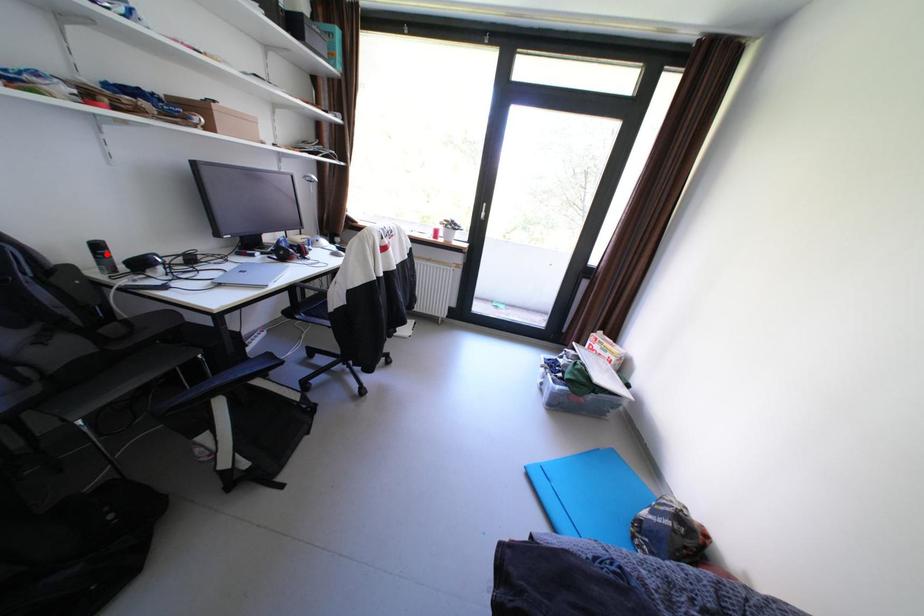
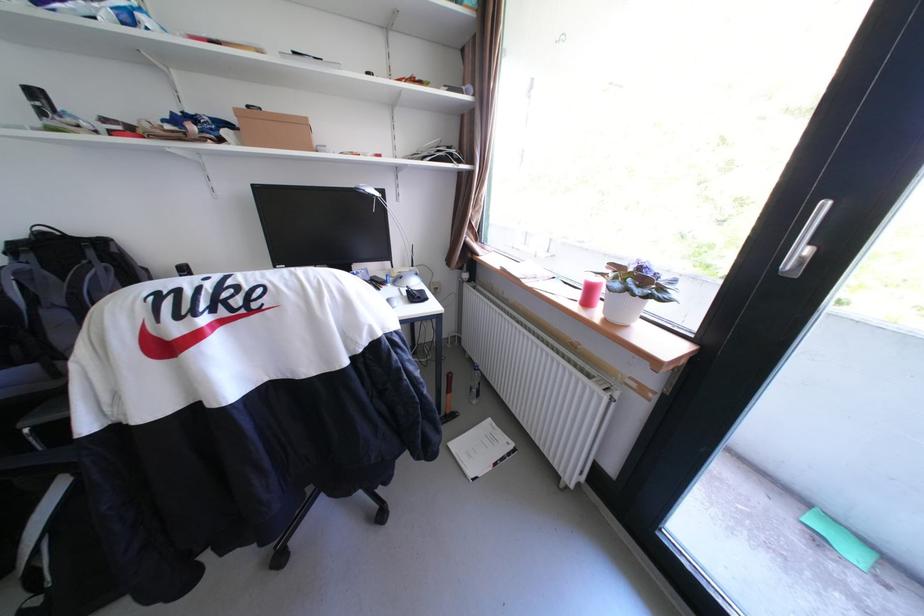
Question: I am providing you with two images of the same scene from different viewpoints. A red point is marked on the first image. Is the red point's position out of view in image 2?

Choices:
 (A) Yes
 (B) No

Answer: (A)